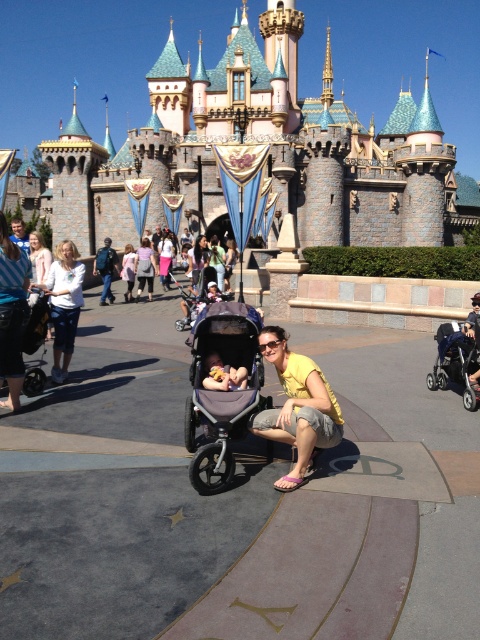
You are a parent trying to push your baby stroller through a narrow doorway that is 1.8 meters wide. The gray fabric stroller at center and the soft pink fabric at center are currently 1.78 meters apart. Can you safely navigate the stroller through the doorway without adjusting their positions?

The gray fabric stroller at center and the soft pink fabric at center are 1.78 meters apart. Since the doorway is 1.8 meters wide, which is slightly wider than the distance between them, you can safely navigate the stroller through the doorway without needing to adjust their positions.

Consider the image. You are standing in front of the Sleeping Beauty Castle at Disneyland. You notice two points marked in the scene. The first point is at coordinates point (294,403) and the second point is at point (148,256). Which point is closer to you?

Point (294,403) is closer to the camera than point (148,256), so the first point is closer to you.

You are a photographer at Disneyland and you see a woman wearing a yellow cotton shirt at center and a white cotton shirt at center. Which shirt is more to the right?

The yellow cotton shirt at center is positioned on the right side of white cotton shirt at center, so the yellow cotton shirt at center is more to the right.